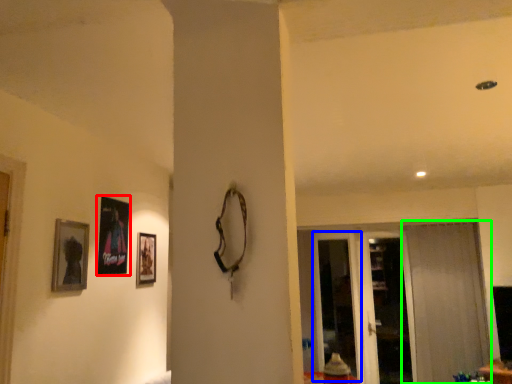
Question: Estimate the real-world distances between objects in this image. Which object is farther from picture frame (highlighted by a red box), screen door (highlighted by a blue box) or curtain (highlighted by a green box)?

Choices:
 (A) screen door
 (B) curtain

Answer: (B)